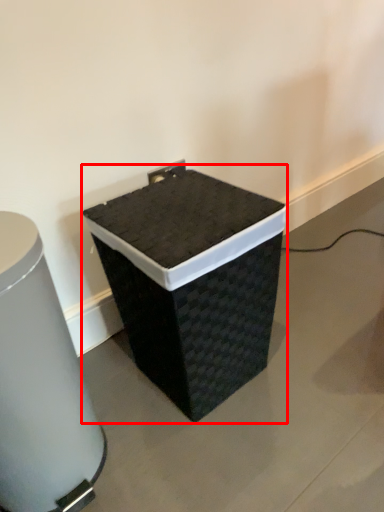
Question: Where is waste container (annotated by the red box) located in relation to waste container in the image?

Choices:
 (A) left
 (B) right

Answer: (B)